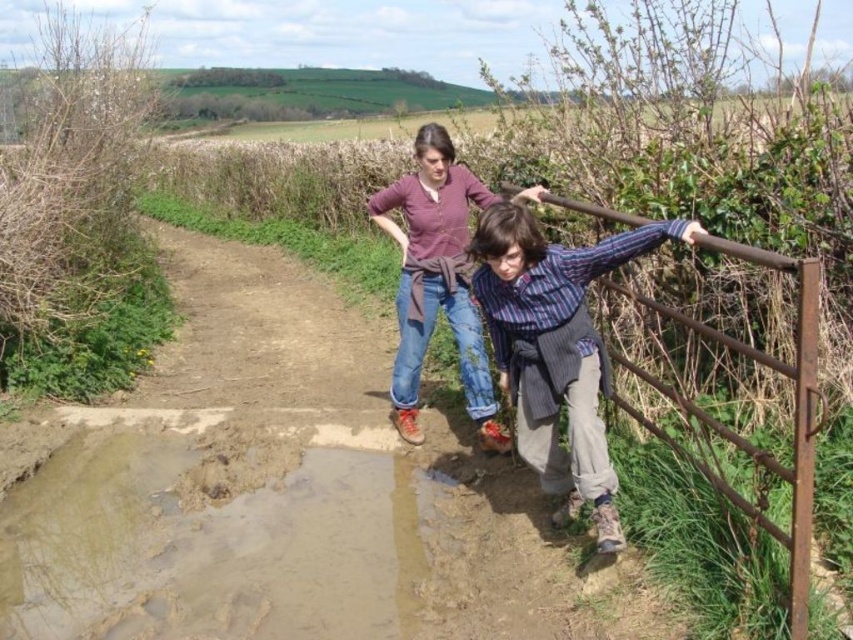
You are a hiker trying to cross the muddy path in the image. There is a muddy wet puddle at lower left. Can you safely step on the point marked as point (x=218, y=544) without getting your shoes wet?

The point (x=218, y=544) is part of the muddy wet puddle at lower left, so stepping there would get your shoes wet.